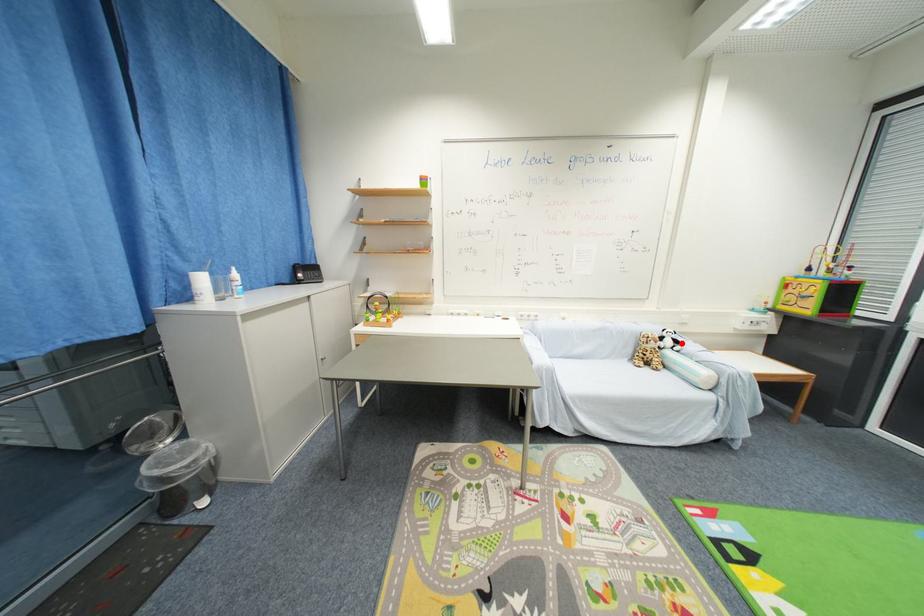
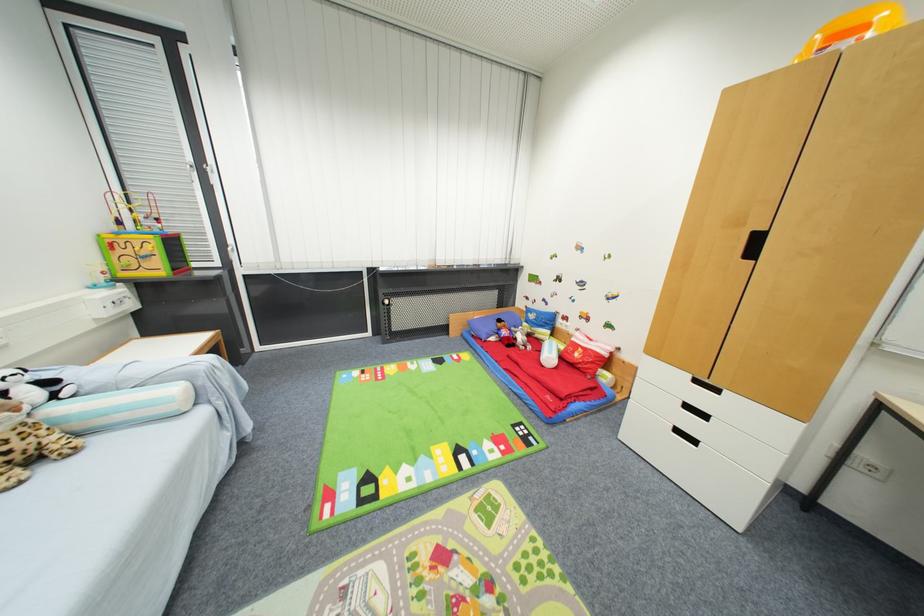
The point at the highlighted location is marked in the first image. Where is the corresponding point in the second image?

(54, 384)